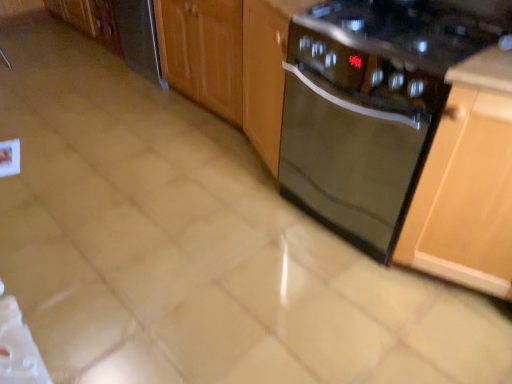
Question: Is black glass dishwasher at center smaller than glossy wood cabinet at center, the first cabinetry positioned from the left?

Choices:
 (A) no
 (B) yes

Answer: (B)

Question: Is there a large distance between black glass dishwasher at center and glossy wood cabinet at center, the first cabinetry from the top?

Choices:
 (A) yes
 (B) no

Answer: (B)

Question: From a real-world perspective, does black glass dishwasher at center sit lower than glossy wood cabinet at center, the second cabinetry in the bottom-to-top sequence?

Choices:
 (A) no
 (B) yes

Answer: (A)

Question: Can you confirm if black glass dishwasher at center is shorter than glossy wood cabinet at center, arranged as the 1th cabinetry when viewed from the back?

Choices:
 (A) yes
 (B) no

Answer: (B)

Question: From a real-world perspective, is black glass dishwasher at center physically above glossy wood cabinet at center, arranged as the 1th cabinetry when viewed from the back?

Choices:
 (A) no
 (B) yes

Answer: (B)

Question: Considering the positions of satin stainless steel dishwasher at left and black glass gas stove at upper right in the image, is satin stainless steel dishwasher at left taller or shorter than black glass gas stove at upper right?

Choices:
 (A) short
 (B) tall

Answer: (B)

Question: Is satin stainless steel dishwasher at left in front of or behind black glass gas stove at upper right in the image?

Choices:
 (A) behind
 (B) front

Answer: (A)

Question: Is satin stainless steel dishwasher at left spatially inside black glass gas stove at upper right, or outside of it?

Choices:
 (A) inside
 (B) outside

Answer: (B)

Question: Based on their positions, is satin stainless steel dishwasher at left located to the left or right of black glass gas stove at upper right?

Choices:
 (A) right
 (B) left

Answer: (B)

Question: From a real-world perspective, is satin stainless steel dishwasher at left positioned above or below black glass dishwasher at center?

Choices:
 (A) below
 (B) above

Answer: (A)

Question: Choose the correct answer: Is satin stainless steel dishwasher at left inside black glass dishwasher at center or outside it?

Choices:
 (A) outside
 (B) inside

Answer: (A)

Question: Looking at their shapes, would you say satin stainless steel dishwasher at left is wider or thinner than black glass dishwasher at center?

Choices:
 (A) thin
 (B) wide

Answer: (A)

Question: Considering the positions of satin stainless steel dishwasher at left and black glass dishwasher at center in the image, is satin stainless steel dishwasher at left bigger or smaller than black glass dishwasher at center?

Choices:
 (A) small
 (B) big

Answer: (A)

Question: Based on their sizes in the image, would you say glossy wood cabinet at center, arranged as the 1th cabinetry when viewed from the back, is bigger or smaller than black glass dishwasher at center?

Choices:
 (A) small
 (B) big

Answer: (B)

Question: Is glossy wood cabinet at center, the second cabinetry in the bottom-to-top sequence, in front of or behind black glass dishwasher at center in the image?

Choices:
 (A) front
 (B) behind

Answer: (B)